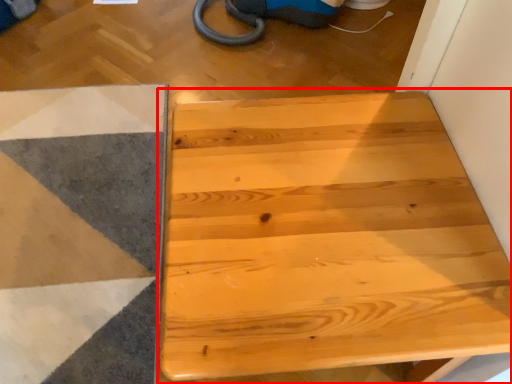
Question: From the image's perspective, what is the correct spatial positioning of table (annotated by the red box) in reference to ramp?

Choices:
 (A) below
 (B) above

Answer: (A)